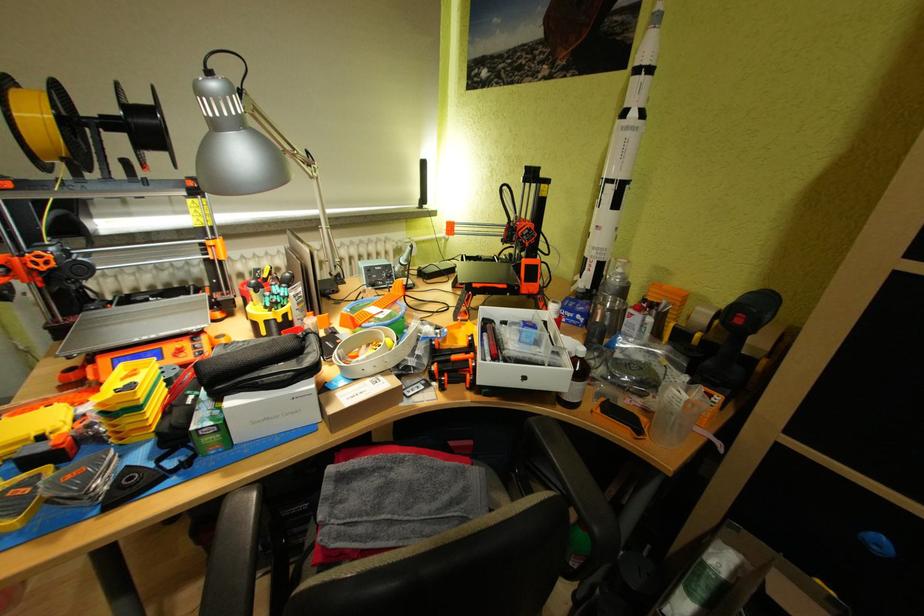
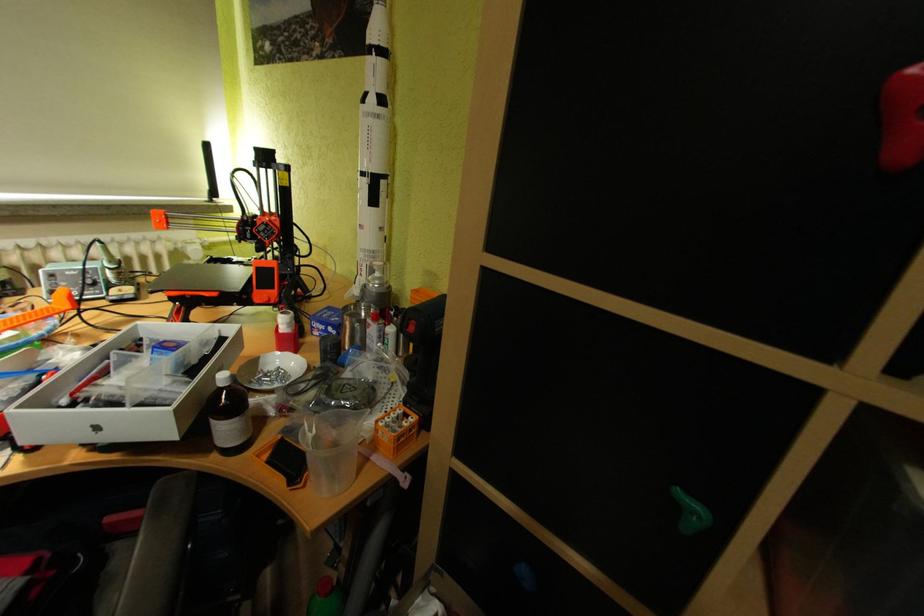
Question: Based on the continuous images, in which direction is the camera rotating? Reply with the corresponding letter.

Choices:
 (A) Left
 (B) Right
 (C) Up
 (D) Down

Answer: (B)